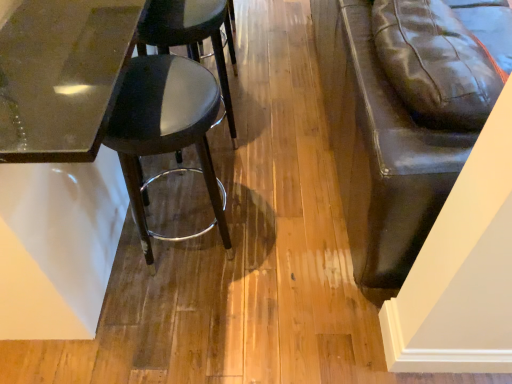
The image size is (512, 384). Identify the location of vacant space underneath matte black stool at left, the 2th stool from the top (from a real-world perspective). (205, 242).